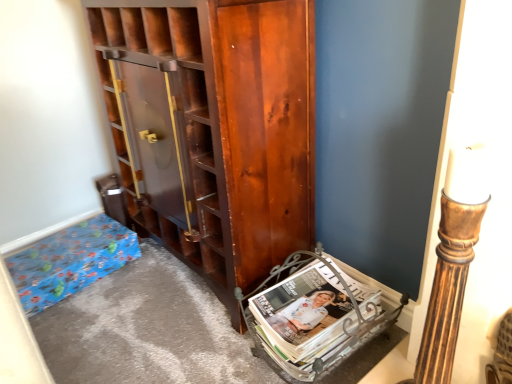
Find the location of a particular element. free space that is in between shiny brown cabinet at center and blue paper bag at lower left is located at coordinates (135, 299).